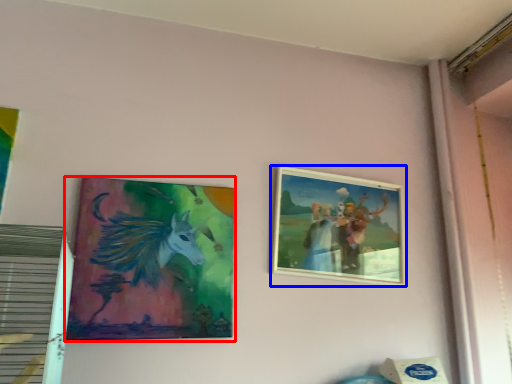
Question: Which object appears farthest to the camera in this image, picture frame (highlighted by a red box) or picture frame (highlighted by a blue box)?

Choices:
 (A) picture frame
 (B) picture frame

Answer: (B)